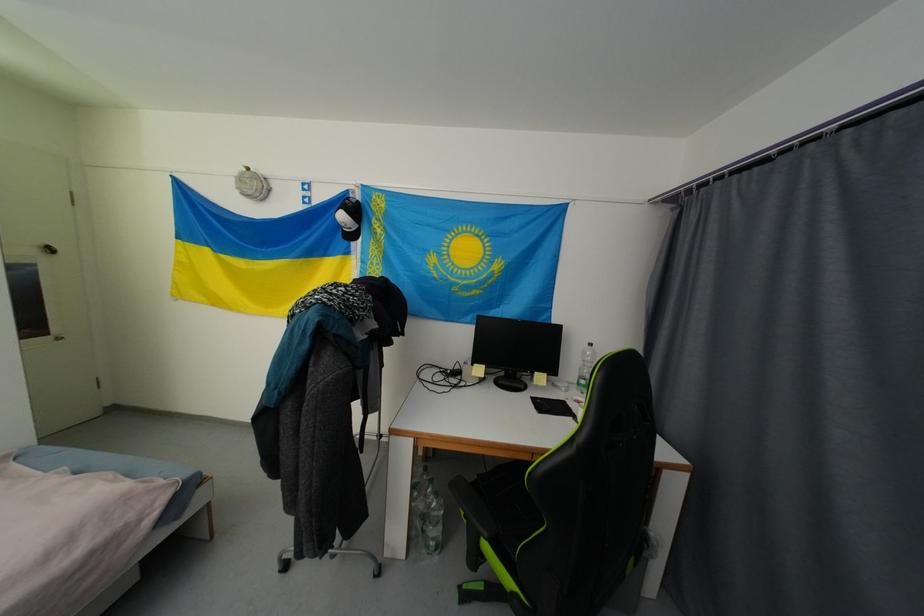
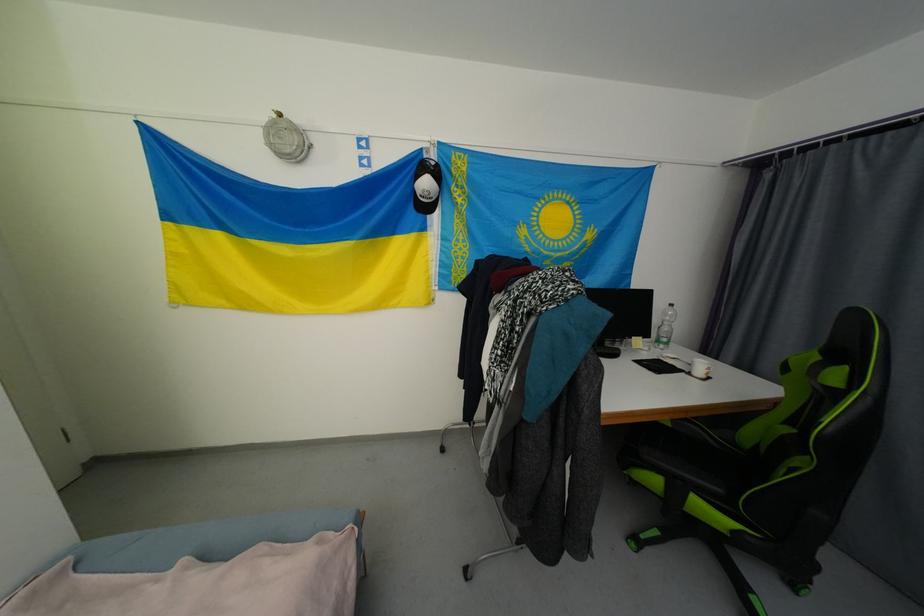
Question: What movement of the cameraman would produce the second image?

Choices:
 (A) Left
 (B) Right
 (C) Forward
 (D) Backward

Answer: (A)